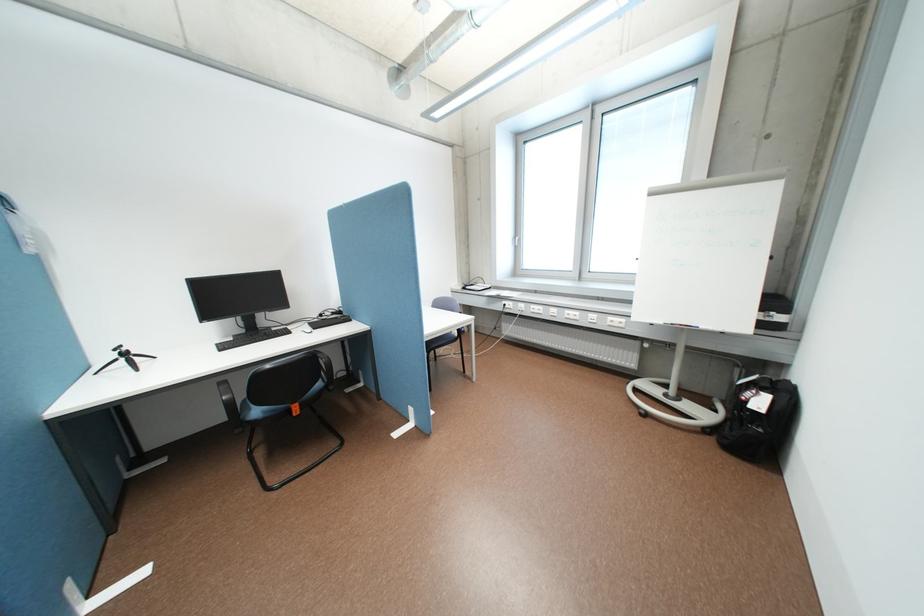
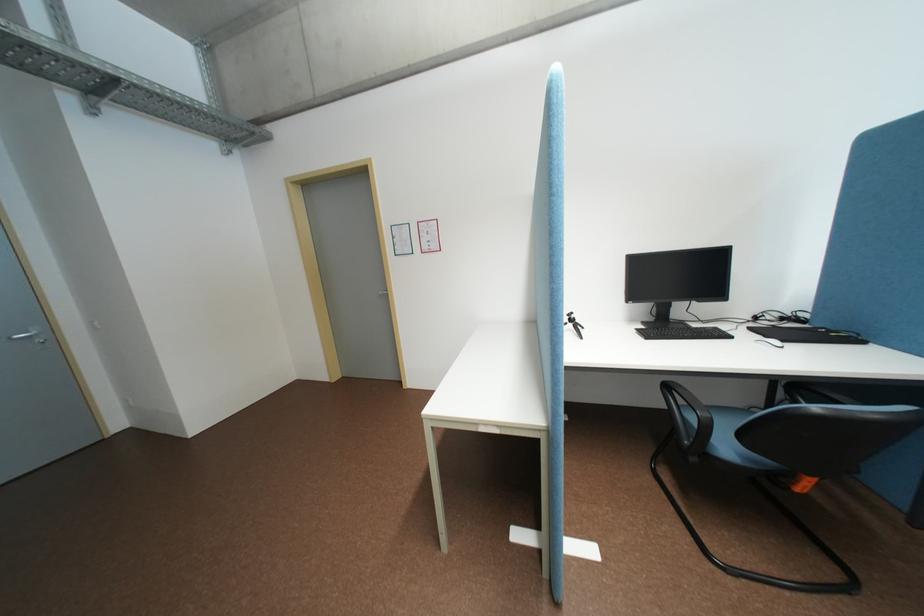
Where in the second image is the point corresponding to the point at 305,414 from the first image?

(808, 488)